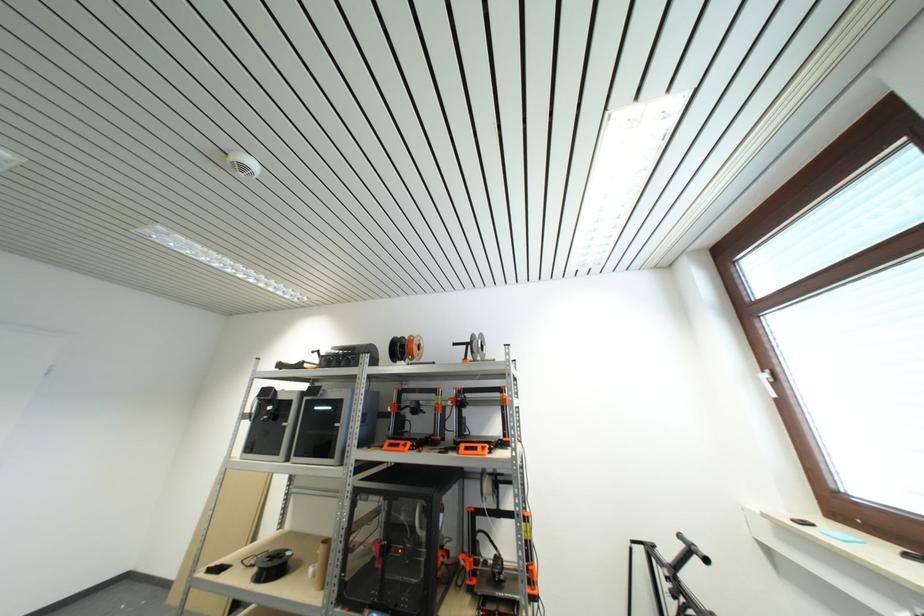
The height and width of the screenshot is (616, 924). What are the coordinates of `white window handle` in the screenshot? It's located at (768, 382).